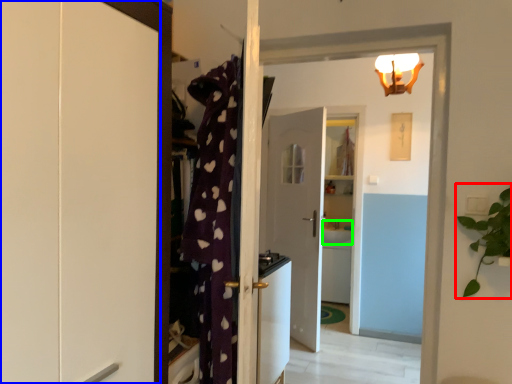
Question: Based on their relative distances, which object is farther from houseplant (highlighted by a red box)? Choose from cabinetry (highlighted by a blue box) and sink (highlighted by a green box).

Choices:
 (A) cabinetry
 (B) sink

Answer: (B)